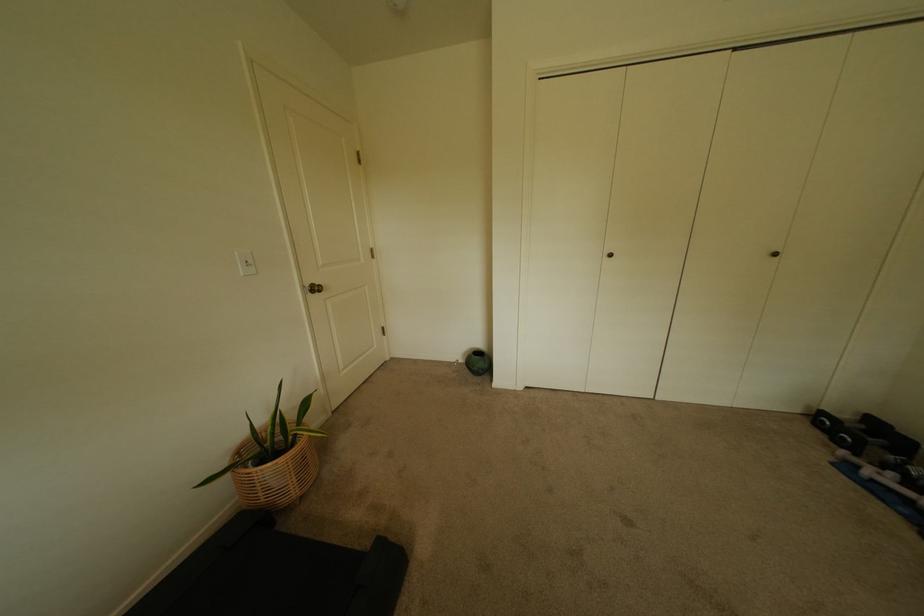
This screenshot has width=924, height=616. I want to click on green kettlebell, so click(x=478, y=362).